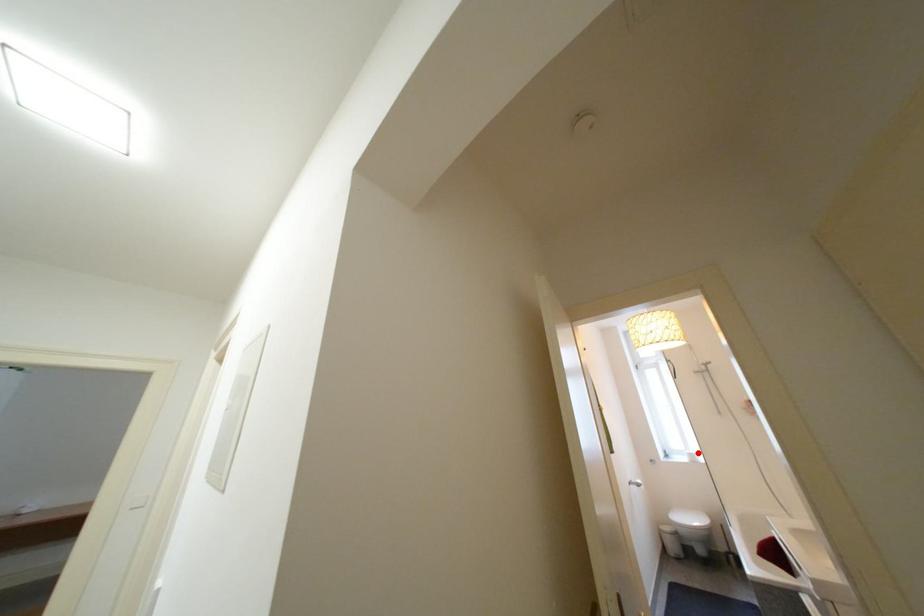
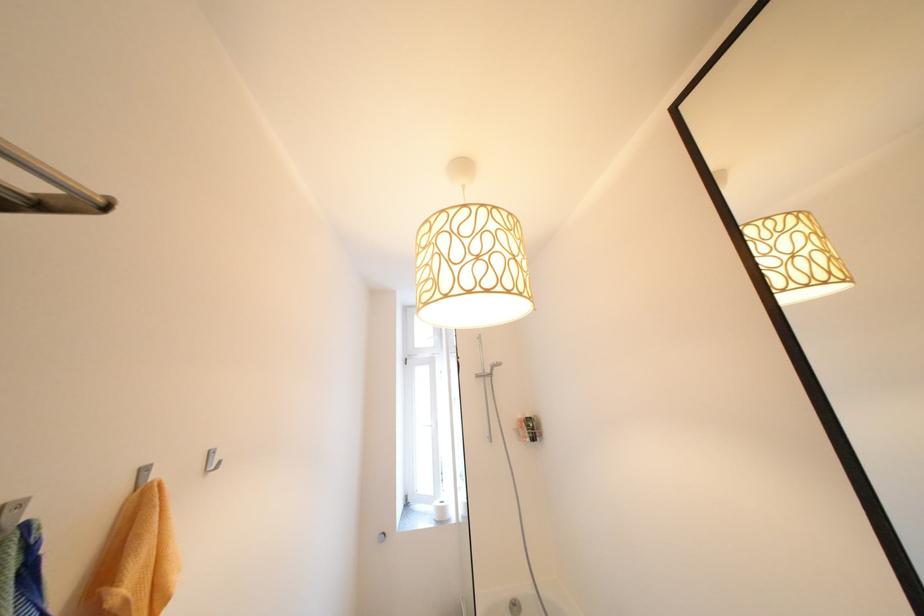
Locate, in the second image, the point that corresponds to the highlighted location in the first image.

(447, 504)